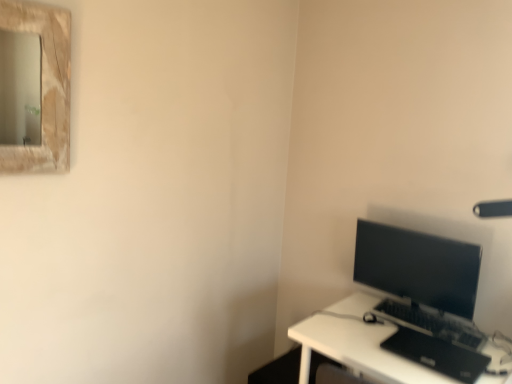
Question: Considering the positions of point coord(441,365) and point coord(426,314), is point coord(441,365) closer or farther from the camera than point coord(426,314)?

Choices:
 (A) closer
 (B) farther

Answer: (A)

Question: From a real-world perspective, relative to black plastic keyboard at lower right, is black matte laptop at lower right vertically above or below?

Choices:
 (A) below
 (B) above

Answer: (A)

Question: Estimate the real-world distances between objects in this image. Which object is closer to the black plastic keyboard at lower right?

Choices:
 (A) black matte laptop at lower right
 (B) matte black monitor at right
 (C) white plastic desk at lower right

Answer: (A)

Question: Based on their relative distances, which object is nearer to the black plastic keyboard at lower right?

Choices:
 (A) black matte laptop at lower right
 (B) matte black monitor at right
 (C) white plastic desk at lower right

Answer: (A)